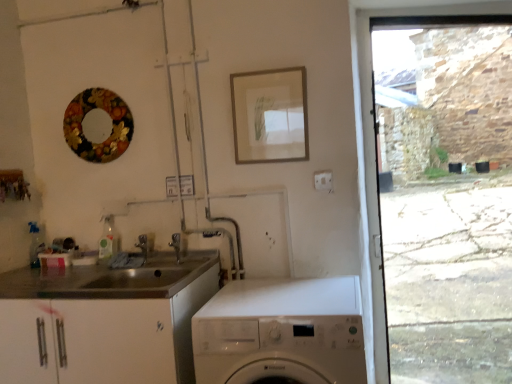
Question: Looking at their shapes, would you say white glossy washing machine at lower center is wider or thinner than silver metallic tap at center, which appears as the first tap when viewed from the back?

Choices:
 (A) thin
 (B) wide

Answer: (B)

Question: Is point (x=314, y=314) positioned closer to the camera than point (x=138, y=236)?

Choices:
 (A) farther
 (B) closer

Answer: (B)

Question: Which object is the closest to the metallic silver faucet at upper center, the 2th tap in the back-to-front sequence?

Choices:
 (A) wooden frame at upper center
 (B) silver metallic tap at center, which ranks as the second tap in right-to-left order
 (C) metallic floral wreath at upper left
 (D) white glossy washing machine at lower center

Answer: (B)

Question: Estimate the real-world distances between objects in this image. Which object is farther from the metallic floral wreath at upper left?

Choices:
 (A) white glossy washing machine at lower center
 (B) wooden frame at upper center
 (C) silver metallic tap at center, which ranks as the second tap in right-to-left order
 (D) metallic silver faucet at upper center, the 2th tap in the back-to-front sequence

Answer: (A)